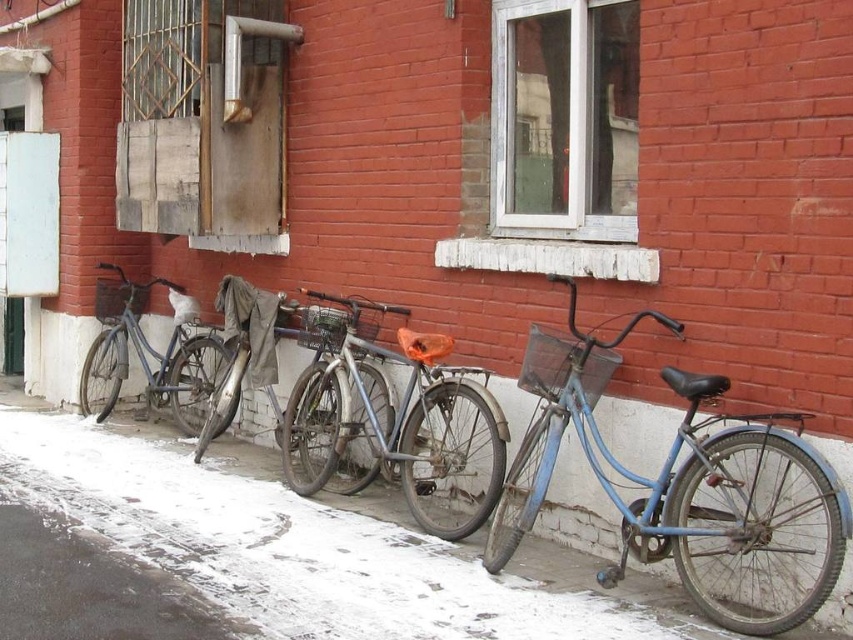
Image resolution: width=853 pixels, height=640 pixels. What are the coordinates of `blue matte bicycle at center` in the screenshot? It's located at (669, 472).

Does blue matte bicycle at center have a greater height compared to matte blue bicycle at left?

Correct, blue matte bicycle at center is much taller as matte blue bicycle at left.

Which is in front, point (699, 387) or point (111, 348)?

Positioned in front is point (699, 387).

Locate an element on the screen. blue matte bicycle at center is located at coordinates (669, 472).

From the picture: Does blue matte bicycle at center have a lesser width compared to shiny metallic bicycle at center?

Result: Yes.

Between blue matte bicycle at center and shiny metallic bicycle at center, which one is positioned higher?

shiny metallic bicycle at center is higher up.

The width and height of the screenshot is (853, 640). What do you see at coordinates (669, 472) in the screenshot?
I see `blue matte bicycle at center` at bounding box center [669, 472].

Where is `blue matte bicycle at center`? The width and height of the screenshot is (853, 640). blue matte bicycle at center is located at coordinates (669, 472).

Does white snow at lower left come in front of shiny metallic bicycle at center?

Yes, it is in front of shiny metallic bicycle at center.

Is white snow at lower left below shiny metallic bicycle at center?

Yes.

Does point (236, 593) come farther from viewer compared to point (287, 444)?

No.

This screenshot has height=640, width=853. I want to click on white snow at lower left, so click(297, 538).